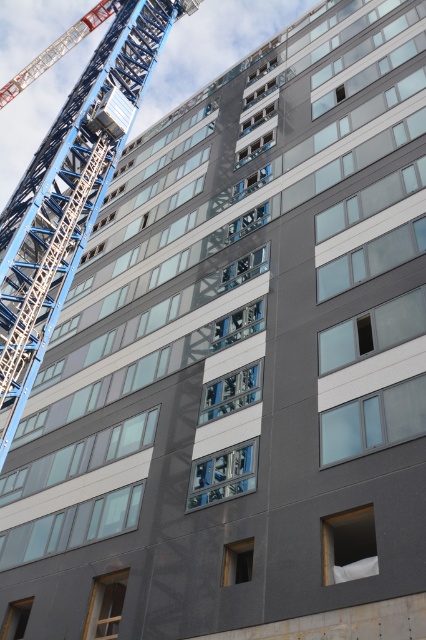
Question: Which point is farther to the camera?

Choices:
 (A) (104, 6)
 (B) (100, 120)
 (C) (74, 228)

Answer: (A)

Question: Observing the image, what is the correct spatial positioning of blue metallic crane at upper left in reference to red painted metal crane arm at upper left?

Choices:
 (A) right
 (B) left

Answer: (A)

Question: Can you confirm if blue metallic crane at upper left is smaller than matte black lift at upper left?

Choices:
 (A) yes
 (B) no

Answer: (B)

Question: Which object is the farthest from the red painted metal crane arm at upper left?

Choices:
 (A) blue metallic crane at upper left
 (B) matte black lift at upper left

Answer: (B)

Question: Which object is positioned farthest from the matte black lift at upper left?

Choices:
 (A) blue metallic crane at upper left
 (B) red painted metal crane arm at upper left

Answer: (B)

Question: Is red painted metal crane arm at upper left wider than matte black lift at upper left?

Choices:
 (A) yes
 (B) no

Answer: (A)